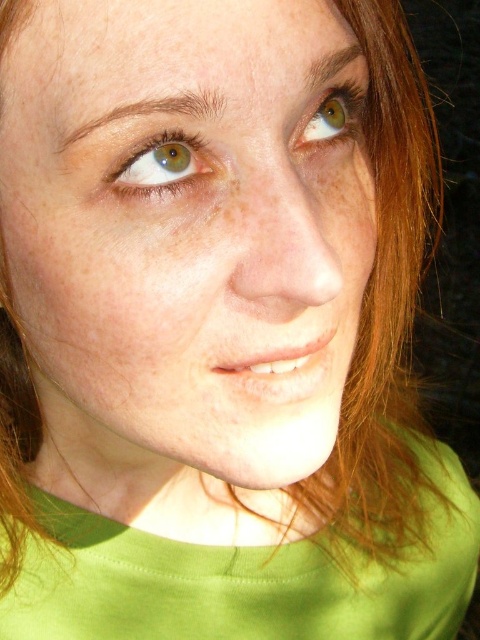
You are an artist trying to sketch this person. You need to place the matte green eye at upper left accurately. According to the coordinates provided, where should you position it on your canvas?

The matte green eye at upper left should be positioned at coordinates point (163, 164).

You are taking a photo of a person and want to focus on their face. You notice two points on their face at coordinates point [21,170] and point [199,179]. Which point is closer to the camera?

Point [21,170] is further to the camera than point [199,179], so point [199,179] is closer to the camera.